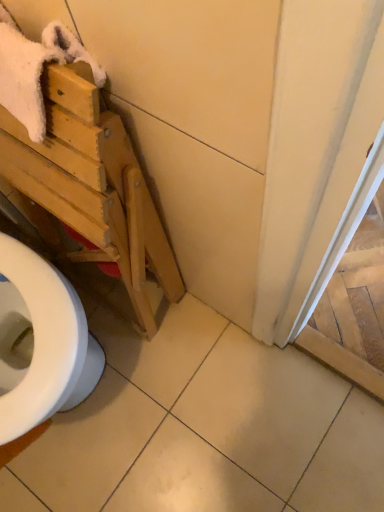
The image size is (384, 512). Identify the location of vacant area situated below light wood folding chair at left (from a real-world perspective). (123, 291).